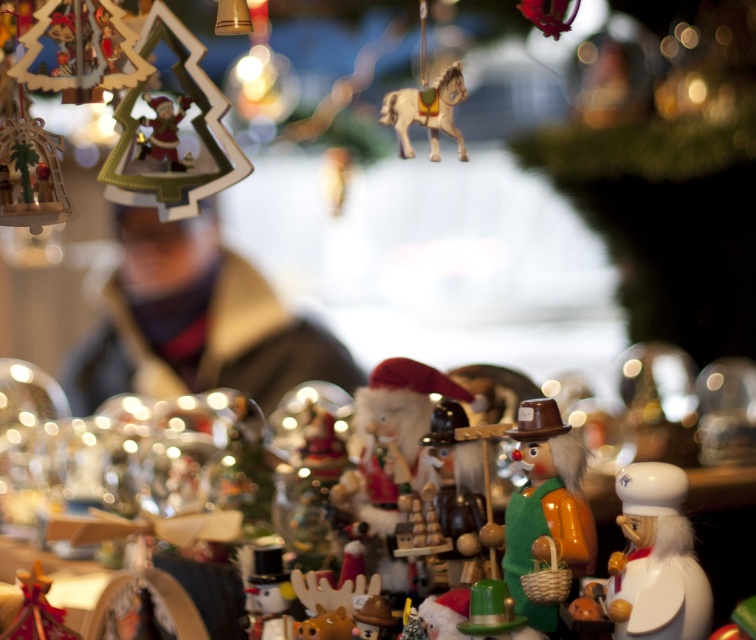
Question: Among these objects, which one is nearest to the camera?

Choices:
 (A) shiny gold horse at upper center
 (B) white glossy nutcracker at lower right

Answer: (B)

Question: Which point appears farthest from the camera in this image?

Choices:
 (A) (527, 548)
 (B) (691, 476)
 (C) (156, 160)
 (D) (679, 472)

Answer: (B)

Question: Does wooden clown at center have a larger size compared to shiny gold horse at upper center?

Choices:
 (A) no
 (B) yes

Answer: (B)

Question: Does white glossy nutcracker at lower right appear under wooden clown at center?

Choices:
 (A) no
 (B) yes

Answer: (B)

Question: Which object is farther from the camera taking this photo?

Choices:
 (A) shiny gold horse at upper center
 (B) wooden clown at center
 (C) wooden nutcracker at center

Answer: (C)

Question: Does wooden clown at center appear on the left side of shiny gold horse at upper center?

Choices:
 (A) no
 (B) yes

Answer: (A)